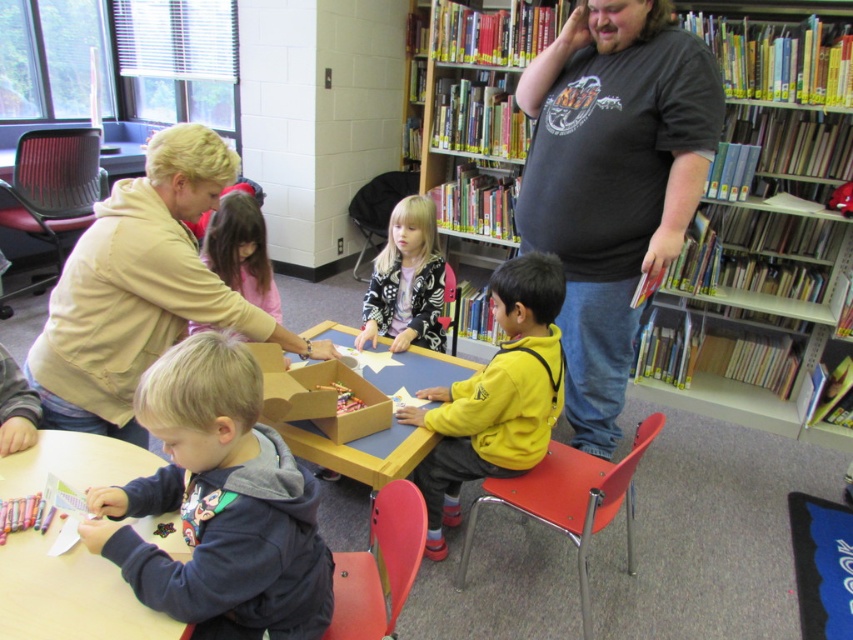
Question: In this image, where is dark gray t-shirt at upper right located relative to dark blue fleece jacket at lower left?

Choices:
 (A) above
 (B) below

Answer: (A)

Question: Can you confirm if wooden bookshelf at upper right is bigger than dark blue fleece jacket at lower left?

Choices:
 (A) no
 (B) yes

Answer: (B)

Question: Which point is closer to the camera?

Choices:
 (A) (363, 481)
 (B) (527, 353)
 (C) (84, 531)

Answer: (C)

Question: Which of these objects is positioned farthest from the wooden bookshelf at upper right?

Choices:
 (A) beige soft jacket at upper left
 (B) dark blue fleece jacket at lower left
 (C) dark gray t-shirt at upper right

Answer: (B)

Question: Does wooden bookshelf at upper right have a larger size compared to blonde hair girl at center?

Choices:
 (A) no
 (B) yes

Answer: (B)

Question: Which point is farther to the camera?

Choices:
 (A) (270, 461)
 (B) (141, 522)

Answer: (B)